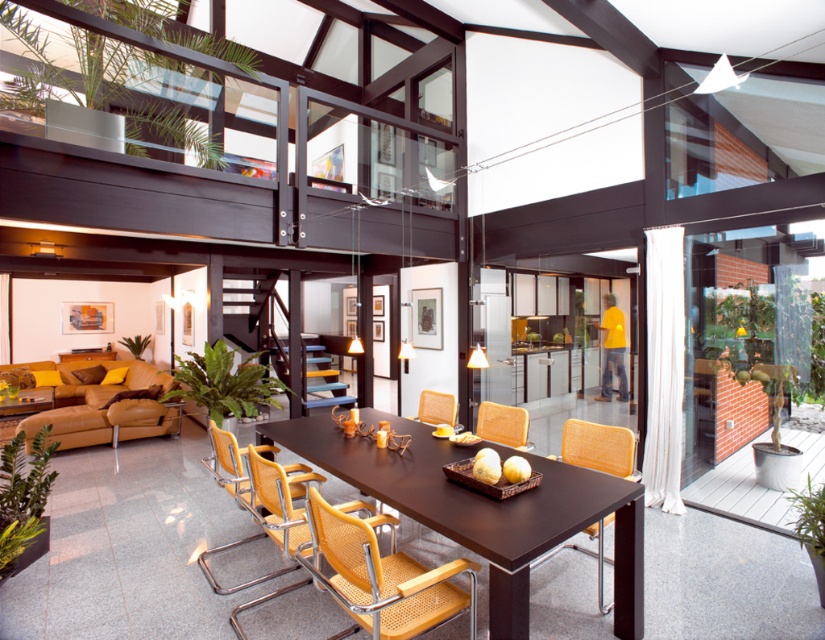
You are a delivery person carrying a large package that requires a clear path of 30 inches to maneuver. You need to move from the orange woven armchair at center to the orange woven chair at right. Is the path between them wide enough for your package?

The distance between the orange woven chair at right and orange woven armchair at center is 25.00 inches, which is narrower than the required 30 inches. Therefore, the path is not wide enough for the package.

You are standing in the living area and want to move from the orange woven armchair at center to the orange woven chair at right. Which direction should you move in?

You should move to the right because the orange woven chair at right is located to the right of the orange woven armchair at center.

You are a guest entering this modern living area and want to sit down. You see the brown wood table at center and the yellow woven chair at center. Which object is higher and would require you to reach up to place items on it?

The brown wood table at center is taller than the yellow woven chair at center, so you would need to reach up to place items on the brown wood table at center.